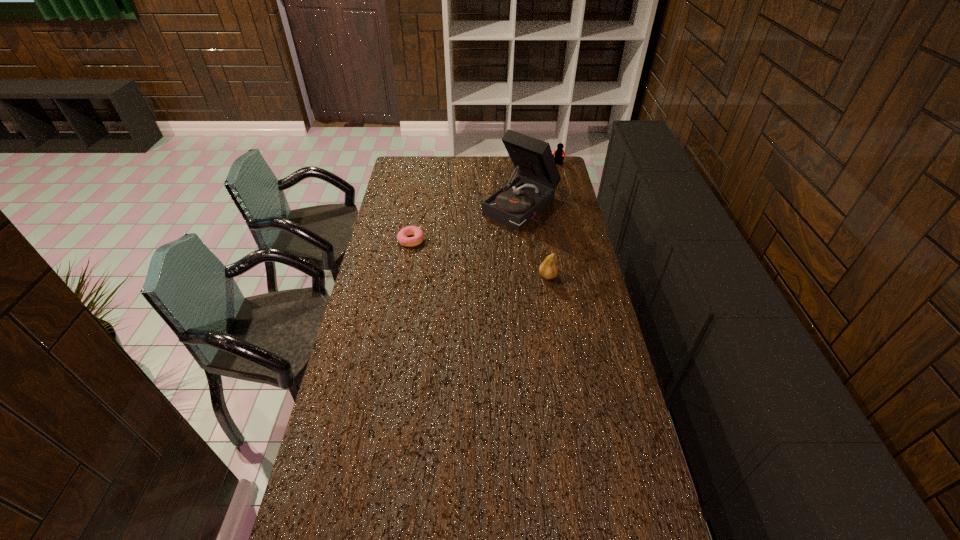
In order to click on free space between the phonograph_record and the pear in this screenshot , I will do click(535, 241).

Where is `blank region between the tallest object and the pear`? blank region between the tallest object and the pear is located at coordinates (535, 241).

Find the location of a particular element. The width and height of the screenshot is (960, 540). object that is the third closest one to the shortest object is located at coordinates (559, 153).

Select which object is the closest to the Lego. Please provide its 2D coordinates. Your answer should be formatted as a tuple, i.e. [(x, y)], where the tuple contains the x and y coordinates of a point satisfying the conditions above.

[(518, 202)]